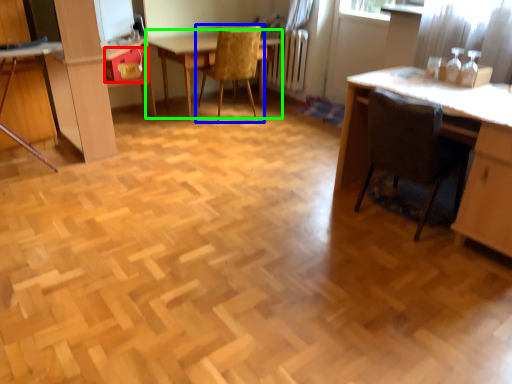
Question: Based on their relative distances, which object is farther from drawer (highlighted by a red box)? Choose from chair (highlighted by a blue box) and table (highlighted by a green box).

Choices:
 (A) chair
 (B) table

Answer: (A)